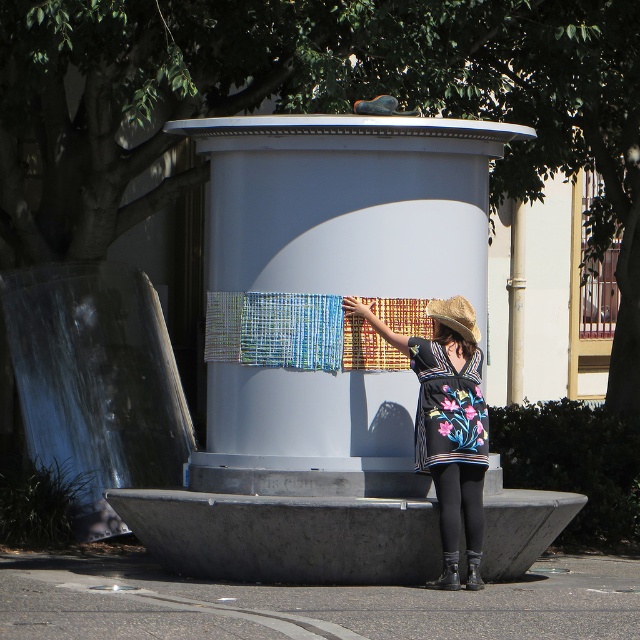
Is point (445, 417) in front of point (483, 531)?

That is True.

Who is taller, floral embroidered dress at center or black tights at lower center?

floral embroidered dress at center is taller.

Where is `floral embroidered dress at center`? floral embroidered dress at center is located at coordinates (448, 406).

Which of these two, white matte pillar at center or black tights at lower center, stands shorter?

Standing shorter between the two is black tights at lower center.

I want to click on white matte pillar at center, so click(x=349, y=204).

This screenshot has width=640, height=640. What do you see at coordinates (292, 332) in the screenshot?
I see `textured woven cloth at center` at bounding box center [292, 332].

Is point (209, 323) positioned behind point (461, 296)?

Yes.

Find the location of a particular element. The height and width of the screenshot is (640, 640). textured woven cloth at center is located at coordinates (292, 332).